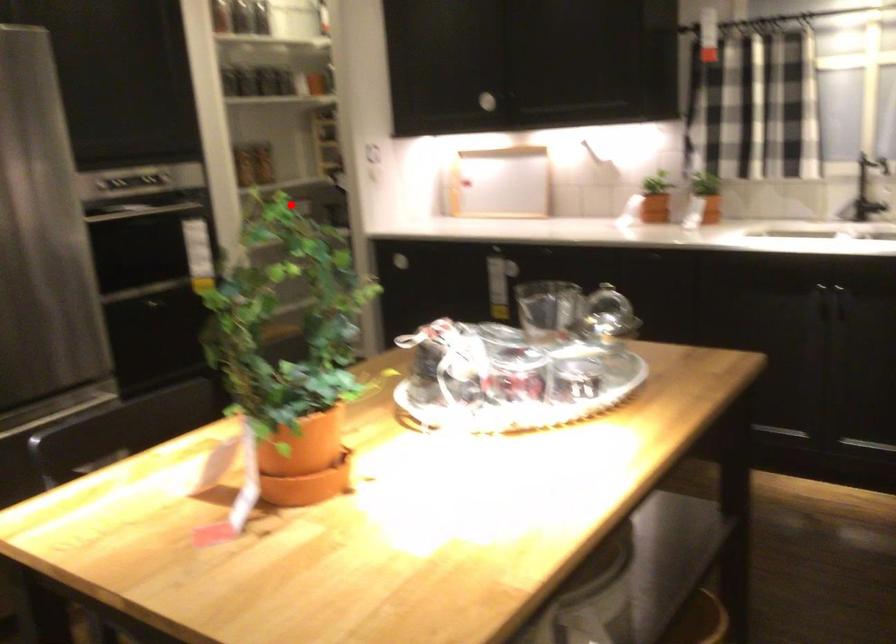
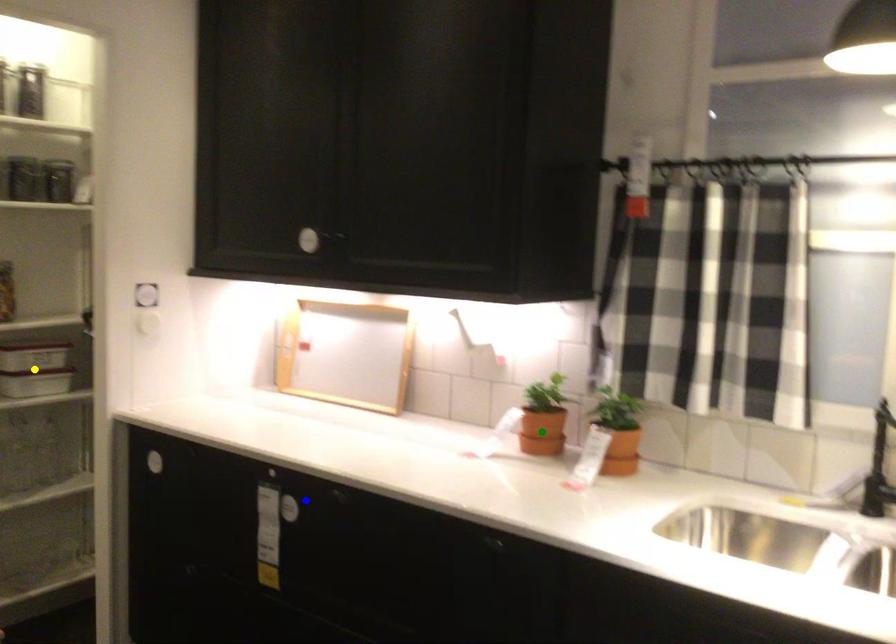
Question: I am providing you with two images of the same scene from different viewpoints. A red point is marked on the first image. You are given multiple points on the second image. Which spot in image 2 lines up with the point in image 1?

Choices:
 (A) green point
 (B) yellow point
 (C) blue point

Answer: (B)